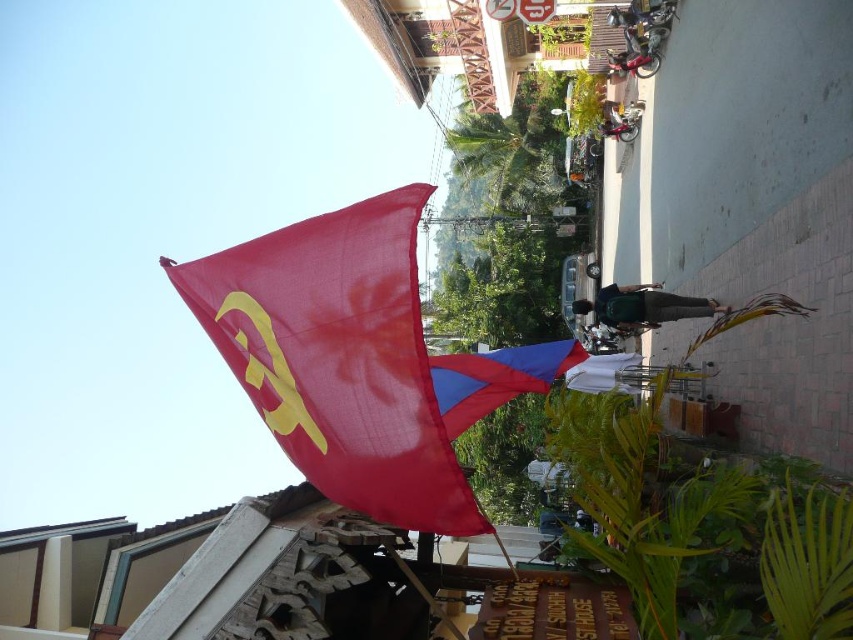
Question: Which of the following is the farthest from the observer?

Choices:
 (A) (437, 524)
 (B) (457, 433)

Answer: (B)

Question: Is matte red flag at upper left below blue fabric kite at center?

Choices:
 (A) yes
 (B) no

Answer: (B)

Question: Which object appears closest to the camera in this image?

Choices:
 (A) blue fabric kite at center
 (B) matte red flag at upper left

Answer: (B)

Question: Which point is farther from the camera taking this photo?

Choices:
 (A) (392, 468)
 (B) (451, 372)

Answer: (B)

Question: Does matte red flag at upper left appear under blue fabric kite at center?

Choices:
 (A) no
 (B) yes

Answer: (A)

Question: Is matte red flag at upper left further to camera compared to blue fabric kite at center?

Choices:
 (A) no
 (B) yes

Answer: (A)